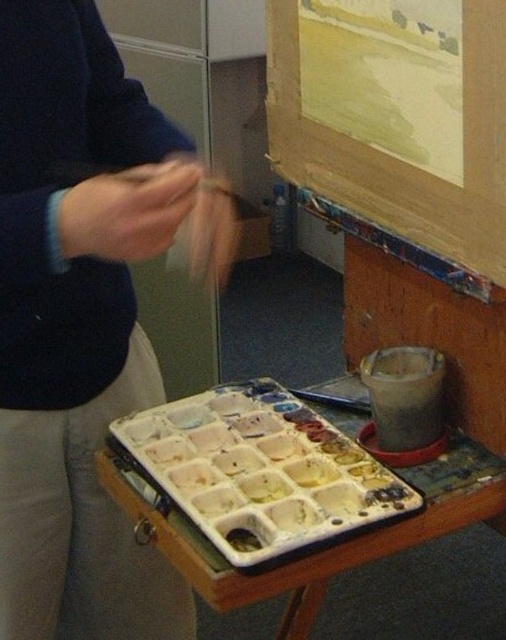
Between matte black sweater at upper left and white matte plastic tray at lower center, which one appears on the right side from the viewer's perspective?

Positioned to the right is white matte plastic tray at lower center.

Between point (7, 371) and point (263, 516), which one is positioned in front?

Point (263, 516)

The image size is (506, 640). What are the coordinates of `matte black sweater at upper left` in the screenshot? It's located at (76, 324).